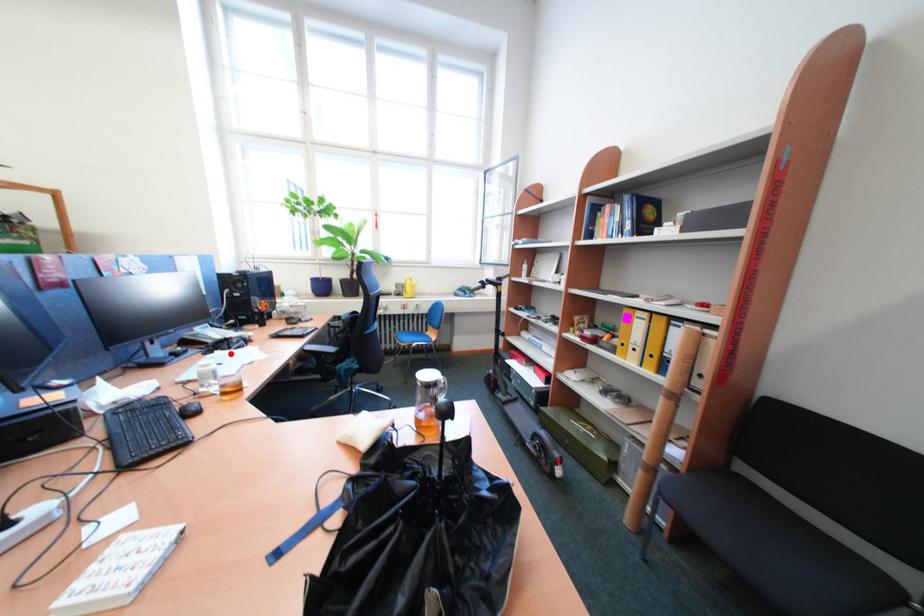
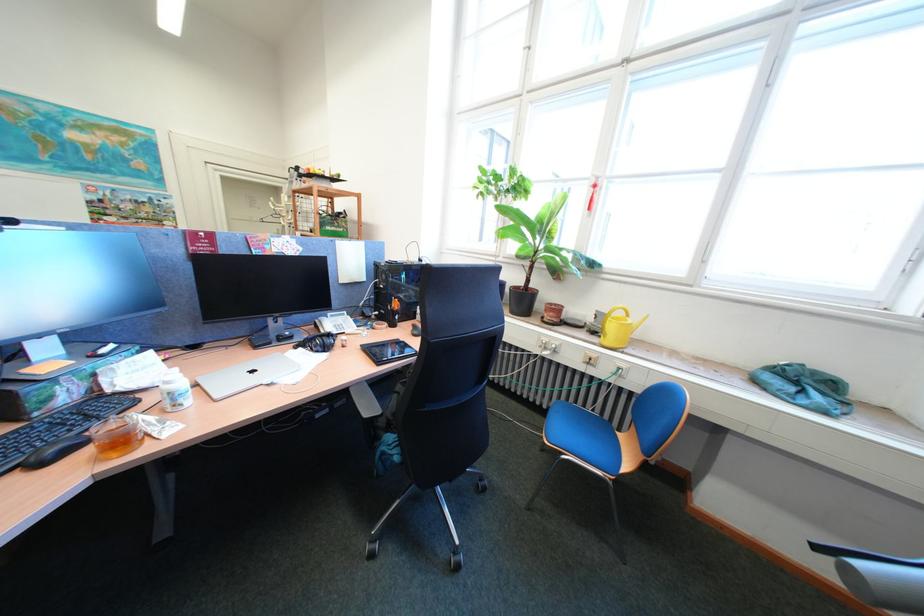
Where in the second image is the point corresponding to the highlighted location from the first image?

(313, 351)